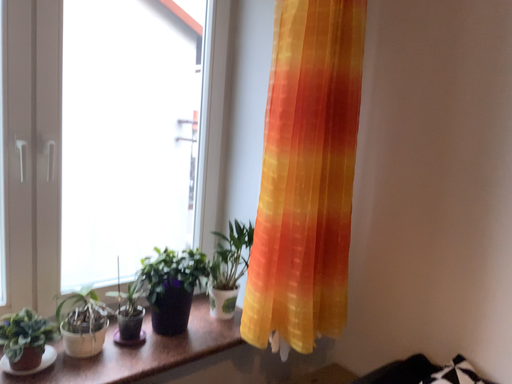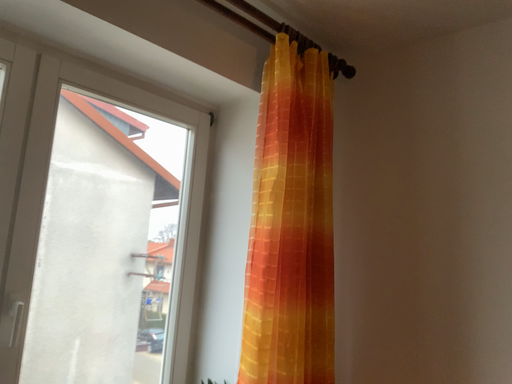
Question: Which way did the camera rotate in the video?

Choices:
 (A) rotated downward
 (B) rotated upward

Answer: (B)